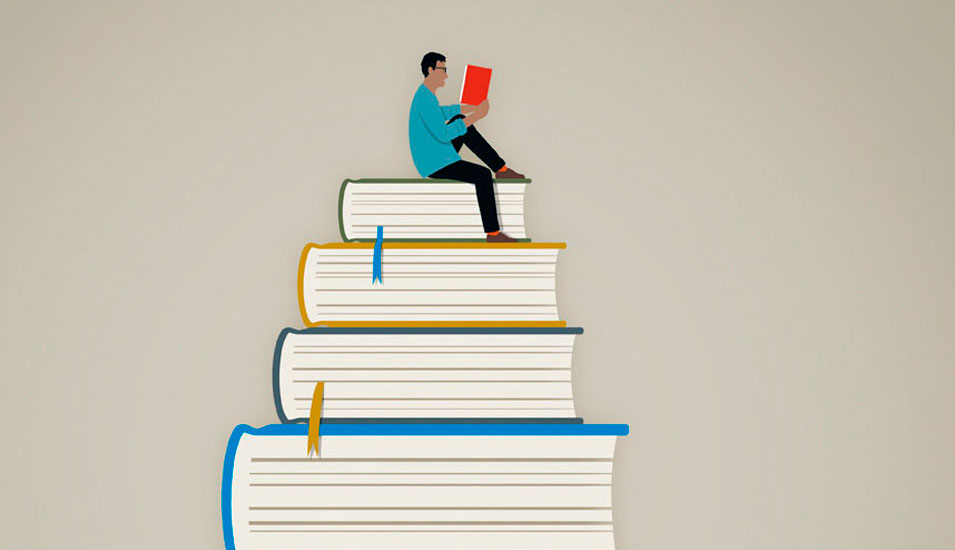
Where is `books`? The width and height of the screenshot is (955, 550). books is located at coordinates (467, 529), (434, 394), (419, 282), (416, 203).